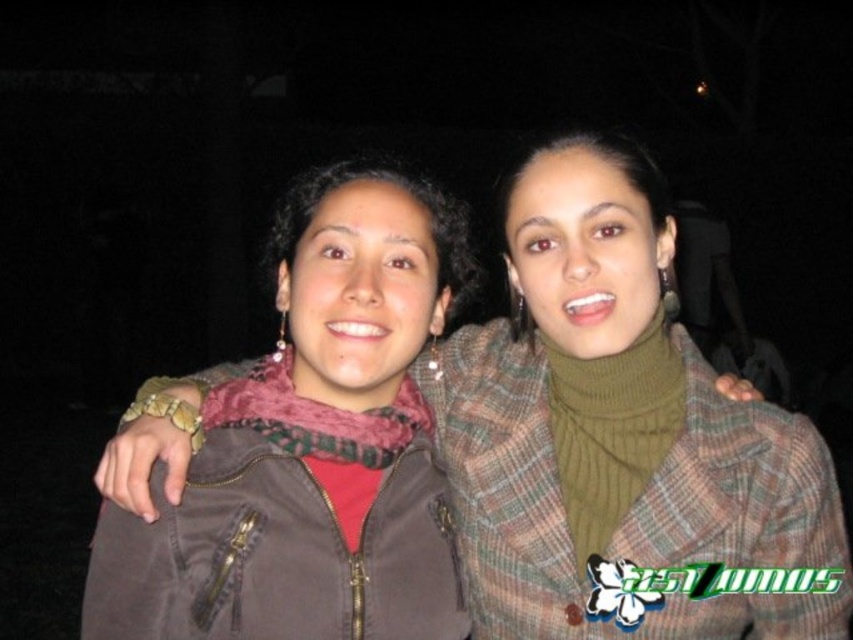
From the picture: You are a photographer standing at a certain distance from the subjects. You want to capture a closeup shot of the matte brown jacket at center without moving the camera. Can you estimate if the jacket is within the camera focus range of 3 feet?

The matte brown jacket at center is 3.44 feet from camera, which is slightly beyond the camera focus range of 3 feet. Therefore, the jacket may not be in focus unless the focus range can extend beyond 3 feet.

You are a photographer trying to capture a clear photo of both the matte brown jacket at center and the brown matte jacket at center in the dark. The camera requires at least 10 inches between subjects for focus. Can you take the photo as it is?

The distance between the matte brown jacket at center and the brown matte jacket at center is 9.72 inches, which is less than the required 10 inches. Therefore, the camera may not be able to focus properly, and you might need to adjust their positions to increase the distance.

Both people are wearing jackets. The person on the left is wearing a matte brown jacket at center, and the person on the right is wearing a brown matte jacket at center. Which jacket is taller?

The matte brown jacket at center is taller than the brown matte jacket at center.